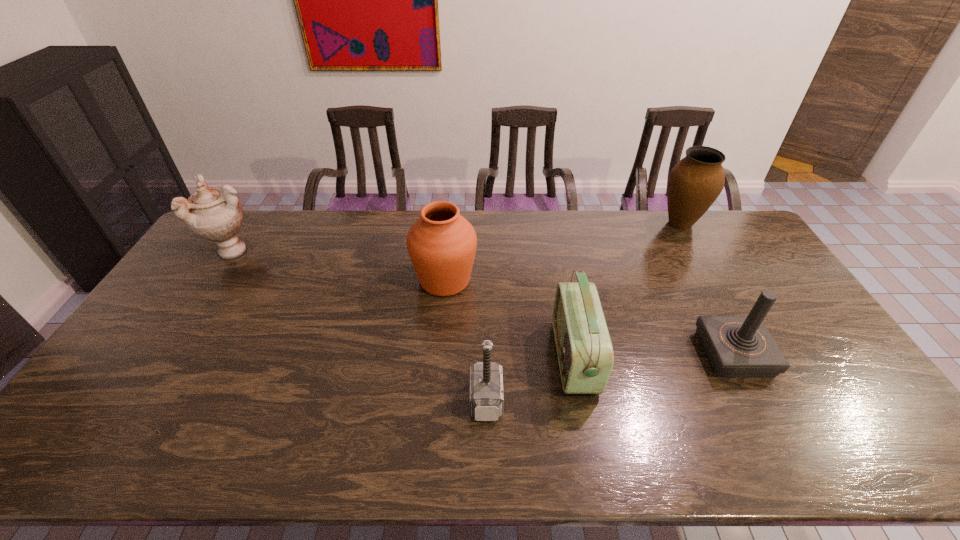
The image size is (960, 540). I want to click on object present at the far left corner, so (x=214, y=214).

Image resolution: width=960 pixels, height=540 pixels. In order to click on object located in the far right corner section of the desktop in this screenshot , I will do `click(695, 182)`.

In the image, there is a desktop. Where is `vacant space at the far edge`? The height and width of the screenshot is (540, 960). vacant space at the far edge is located at coordinates (294, 220).

What are the coordinates of `vacant space at the near edge of the desktop` in the screenshot? It's located at (712, 435).

Where is `free space at the left edge of the desktop`? Image resolution: width=960 pixels, height=540 pixels. free space at the left edge of the desktop is located at coordinates (198, 326).

Find the location of a particular element. Image resolution: width=960 pixels, height=540 pixels. vacant point at the right edge is located at coordinates (802, 357).

Where is `vacant space at the far right corner of the desktop`? The image size is (960, 540). vacant space at the far right corner of the desktop is located at coordinates (749, 243).

The image size is (960, 540). What are the coordinates of `vacant area that lies between the second urn from right to left and the leftmost urn` in the screenshot? It's located at (340, 266).

At what (x,y) coordinates should I click in order to perform the action: click on empty space between the rightmost urn and the radio receiver. Please return your answer as a coordinate pair (x, y). Looking at the image, I should click on (627, 291).

The height and width of the screenshot is (540, 960). I want to click on empty location between the joystick and the radio receiver, so click(654, 355).